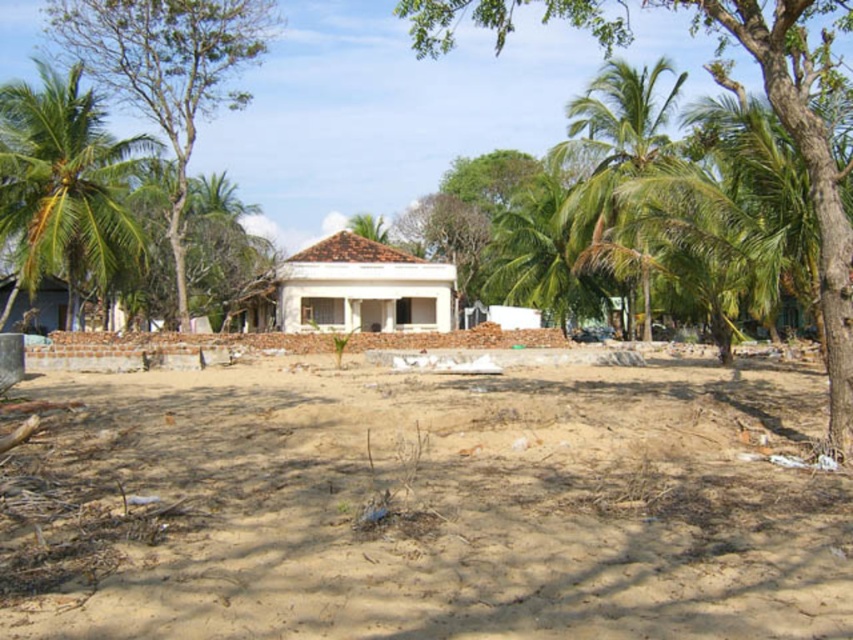
Can you confirm if green leafy tree at left is wider than green leafy palm tree at right?

Correct, the width of green leafy tree at left exceeds that of green leafy palm tree at right.

Can you confirm if green leafy tree at left is shorter than green leafy palm tree at right?

Yes.

Where is `green leafy tree at left`? This screenshot has height=640, width=853. green leafy tree at left is located at coordinates coord(167,70).

Who is lower down, green leafy palm tree at left or white matte house at center?

white matte house at center is below.

Can you confirm if green leafy palm tree at left is smaller than white matte house at center?

Correct, green leafy palm tree at left occupies less space than white matte house at center.

Which is behind, point (67, 298) or point (395, 262)?

The point (395, 262) is behind.

Find the location of `green leafy palm tree at left`. green leafy palm tree at left is located at coordinates (65, 186).

Does point (553, 460) come behind point (61, 173)?

That is False.

Who is more forward, [283,552] or [54,272]?

Point [283,552]

I want to click on brown sandy dirt field at center, so click(426, 504).